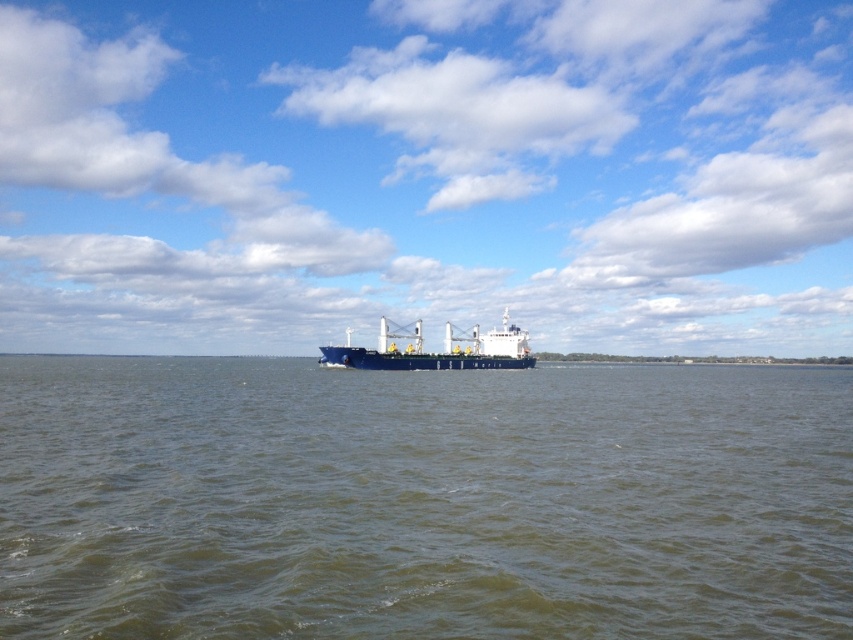
Identify the location of greenish water at center. (421, 500).

I want to click on greenish water at center, so click(x=421, y=500).